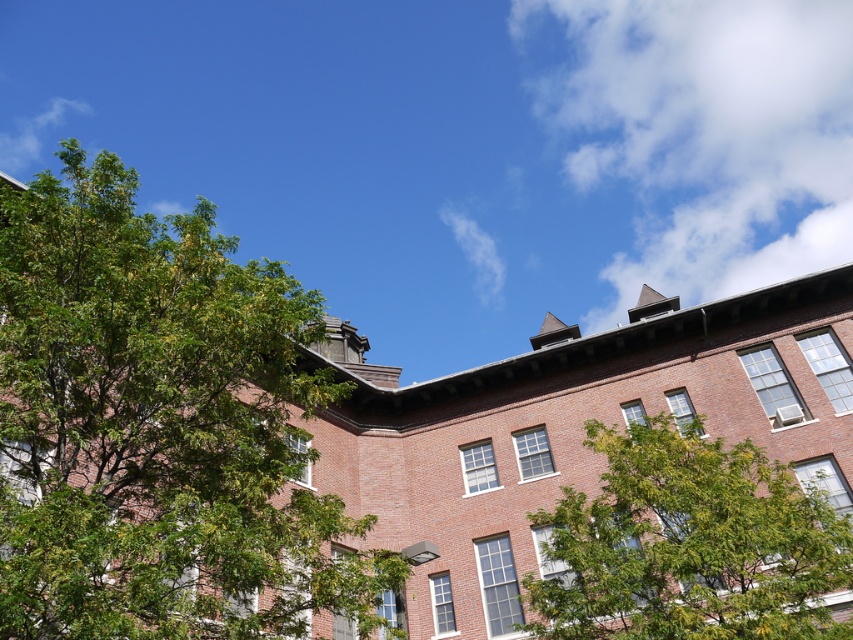
You are standing in front of the brick building and see the green leafy tree at upper left and the green leafy tree at lower right. Which tree is closer to the left side of the building?

The green leafy tree at upper left is positioned on the left side of the green leafy tree at lower right, so it is closer to the left side of the building.

You are standing in front of the brick building and want to take a photo that includes both the green leafy tree at upper left and the green leafy tree at lower right. Which tree will appear bigger in the photo?

The green leafy tree at upper left will appear bigger in the photo because it is larger in size than the green leafy tree at lower right.

You are standing in front of the brick building and want to determine which of the two points, point [219,392] or point [548,548], is nearer to you. Based on the scene description, which point is closer?

Point [219,392] is closer to the viewer than point [548,548].